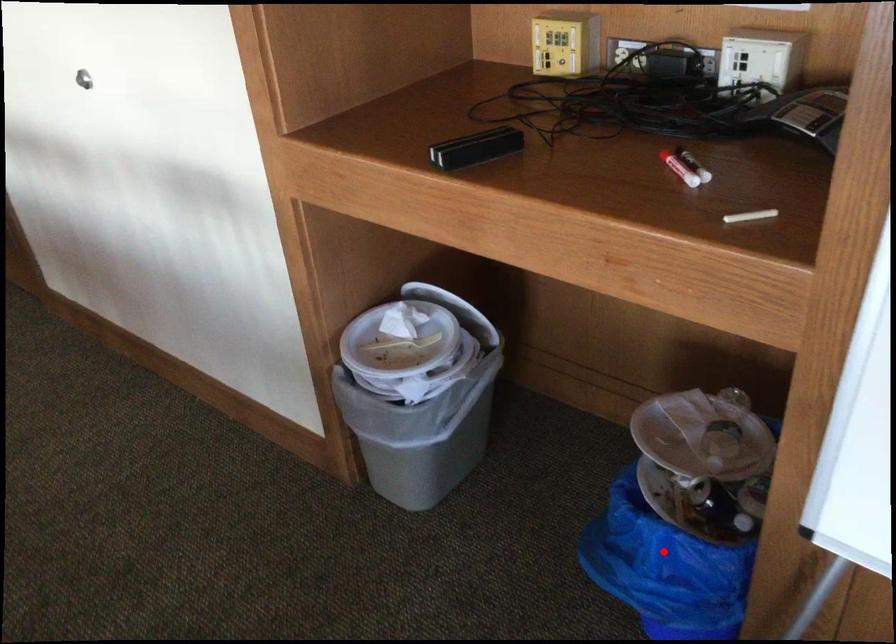
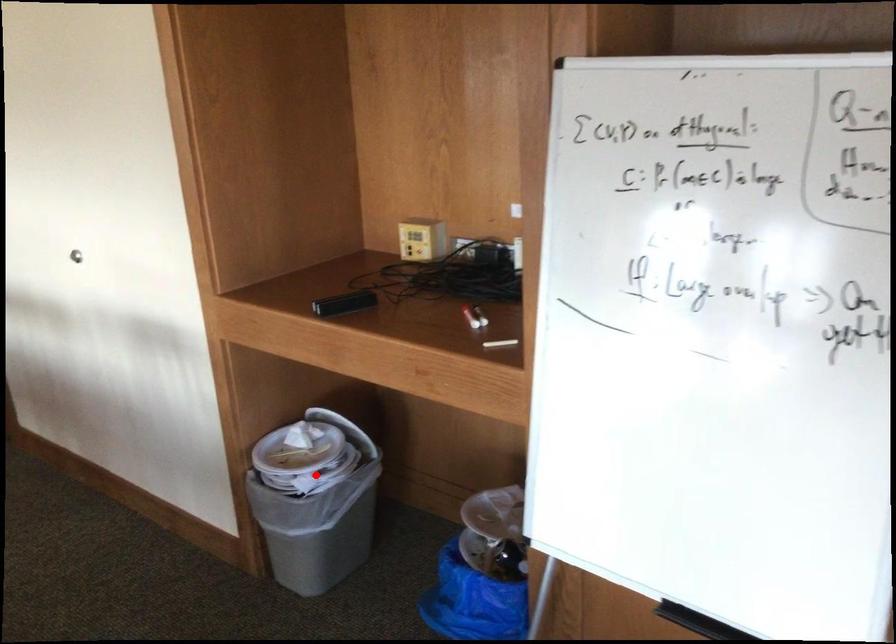
I am providing you with two images of the same scene from different viewpoints. A red point is marked on the first image and another point is marked on the second image. Does the point marked in image1 correspond to the same location as the one in image2?

No